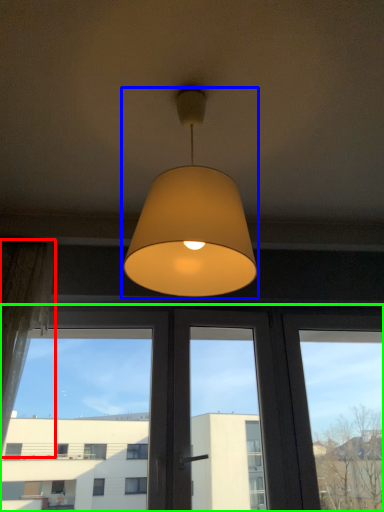
Question: Which object is positioned closest to curtain (highlighted by a red box)? Select from lamp (highlighted by a blue box) and window (highlighted by a green box).

Choices:
 (A) lamp
 (B) window

Answer: (B)